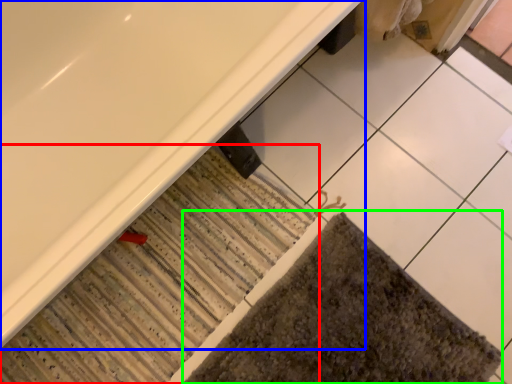
Question: Considering the real-world distances, which object is closest to bath mat (highlighted by a red box)? bathtub (highlighted by a blue box) or bath mat (highlighted by a green box).

Choices:
 (A) bathtub
 (B) bath mat

Answer: (B)